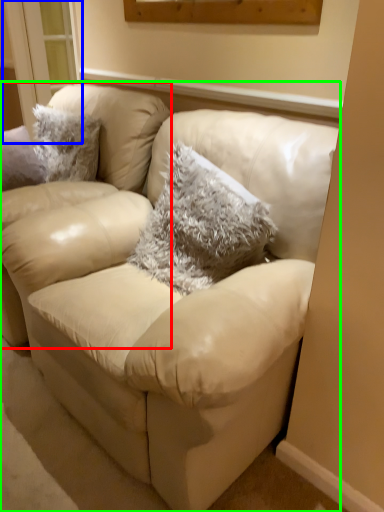
Question: Which object is the farthest from chair (highlighted by a red box)? Choose among these: window (highlighted by a blue box) or studio couch (highlighted by a green box).

Choices:
 (A) window
 (B) studio couch

Answer: (A)